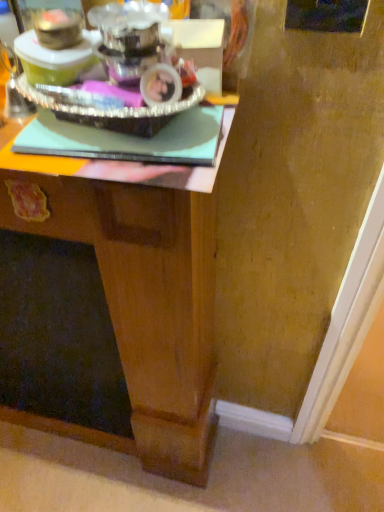
Question: Is the depth of wooden desk at center greater than that of silver metallic tray at upper left?

Choices:
 (A) yes
 (B) no

Answer: (A)

Question: From the image's perspective, is wooden desk at center located above silver metallic tray at upper left?

Choices:
 (A) yes
 (B) no

Answer: (B)

Question: From a real-world perspective, is wooden desk at center physically above silver metallic tray at upper left?

Choices:
 (A) yes
 (B) no

Answer: (B)

Question: From the image's perspective, is wooden desk at center below silver metallic tray at upper left?

Choices:
 (A) yes
 (B) no

Answer: (A)

Question: Considering the relative sizes of wooden desk at center and silver metallic tray at upper left in the image provided, is wooden desk at center smaller than silver metallic tray at upper left?

Choices:
 (A) yes
 (B) no

Answer: (B)

Question: Can you confirm if wooden desk at center is positioned to the left of silver metallic tray at upper left?

Choices:
 (A) no
 (B) yes

Answer: (B)

Question: Is silver metallic tray at upper left at the right side of wooden desk at center?

Choices:
 (A) no
 (B) yes

Answer: (B)

Question: Is silver metallic tray at upper left in contact with wooden desk at center?

Choices:
 (A) no
 (B) yes

Answer: (A)

Question: Does silver metallic tray at upper left lie behind wooden desk at center?

Choices:
 (A) yes
 (B) no

Answer: (B)

Question: From a real-world perspective, is silver metallic tray at upper left located higher than wooden desk at center?

Choices:
 (A) yes
 (B) no

Answer: (A)

Question: From the image's perspective, is silver metallic tray at upper left located above wooden desk at center?

Choices:
 (A) yes
 (B) no

Answer: (A)

Question: Does silver metallic tray at upper left have a larger size compared to wooden desk at center?

Choices:
 (A) no
 (B) yes

Answer: (A)

Question: In terms of size, does wooden desk at center appear bigger or smaller than silver metallic tray at upper left?

Choices:
 (A) small
 (B) big

Answer: (B)